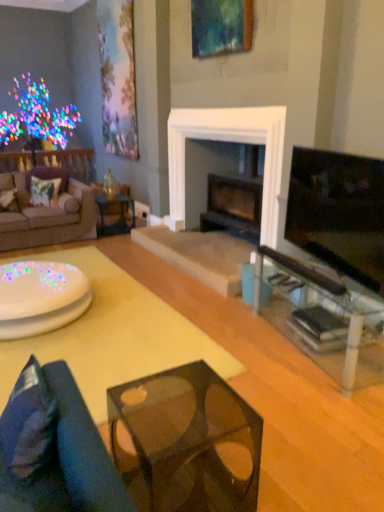
Find the location of a particular element. This screenshot has width=384, height=512. blank space to the left of transparent glass table at right, placed as the 1th table when sorted from right to left is located at coordinates (228, 345).